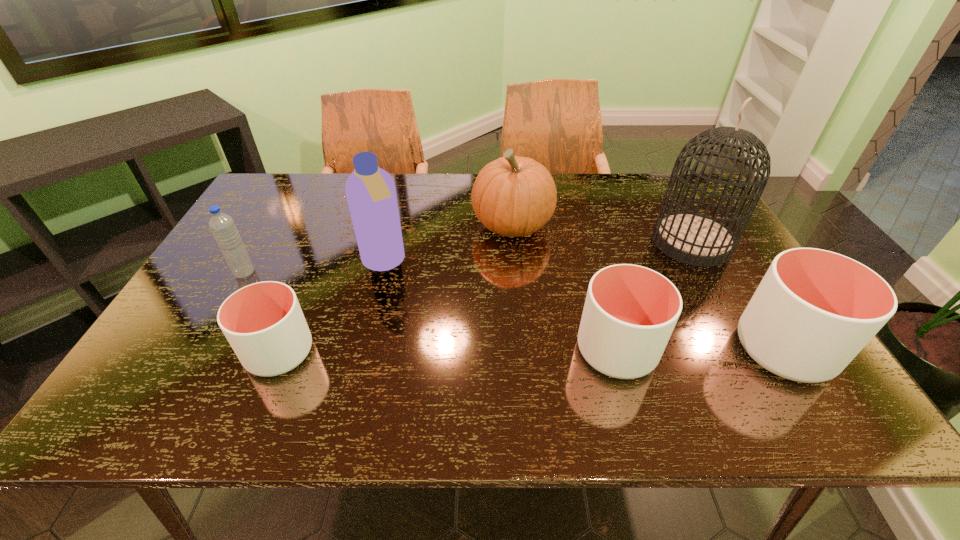
Identify the location of free region located 0.270m on the right of the leftmost cup. Image resolution: width=960 pixels, height=540 pixels. (434, 353).

The height and width of the screenshot is (540, 960). In order to click on vacant point located 0.270m on the back of the second shortest object in this screenshot , I will do `click(588, 248)`.

Identify the location of vacant area situated on the left of the rightmost cup. (635, 349).

Where is `free space located on the stem of the fifth shortest object`? The height and width of the screenshot is (540, 960). free space located on the stem of the fifth shortest object is located at coordinates (415, 225).

Locate an element on the screen. free space located on the stem of the fifth shortest object is located at coordinates (343, 225).

Locate an element on the screen. Image resolution: width=960 pixels, height=540 pixels. vacant area situated 0.200m on the stem of the fifth shortest object is located at coordinates (405, 225).

Where is `vacant space located 0.240m on the back of the water bottle`? This screenshot has height=540, width=960. vacant space located 0.240m on the back of the water bottle is located at coordinates (x=277, y=214).

This screenshot has width=960, height=540. I want to click on free space located 0.260m on the back of the tallest object, so click(x=655, y=176).

Where is `vacant position located on the left of the second tallest object`? This screenshot has height=540, width=960. vacant position located on the left of the second tallest object is located at coordinates (284, 262).

I want to click on object present at the far edge, so click(x=513, y=196).